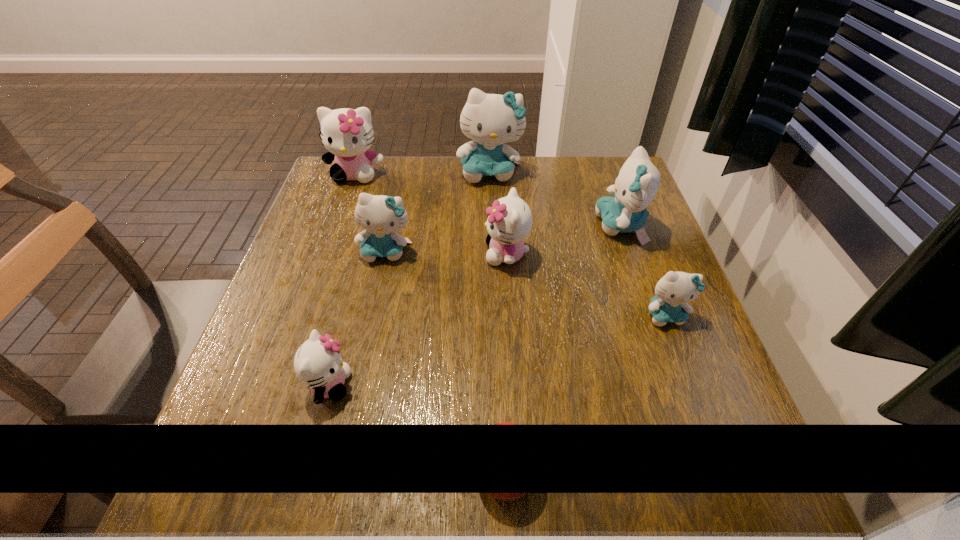
This screenshot has height=540, width=960. Identify the location of free location that satisfies the following two spatial constraints: 1. on the front-facing side of the nearest white kitten; 2. on the right side of the shortest object. 307,469.

At what (x,y) coordinates should I click in order to perform the action: click on free region that satisfies the following two spatial constraints: 1. on the front-facing side of the biggest white kitten; 2. on the left side of the nearest object. Please return your answer as a coordinate pair (x, y). The height and width of the screenshot is (540, 960). Looking at the image, I should click on (252, 469).

You are a GUI agent. You are given a task and a screenshot of the screen. Output one action in this format:
    pyautogui.click(x=<x>, y=<y>)
    Task: Click on the free space that satisfies the following two spatial constraints: 1. on the face of the tallest kitten; 2. on the front-facing side of the smallest white kitten
    
    Given the screenshot: What is the action you would take?
    pyautogui.click(x=496, y=386)

Locate an element on the screen. free point that satisfies the following two spatial constraints: 1. on the face of the nearest object; 2. on the left side of the second smallest blue kitten is located at coordinates (339, 469).